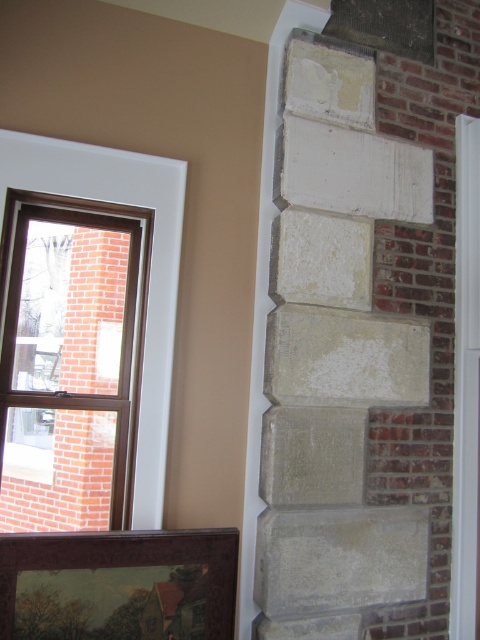
Between white stone carving at center and brown wooden picture frame at lower left, which one appears on the right side from the viewer's perspective?

Positioned to the right is white stone carving at center.

Is white stone carving at center closer to camera compared to brown wooden picture frame at lower left?

No, it is not.

Does point (292, 259) lie in front of point (176, 627)?

No.

Find the location of a particular element. This screenshot has width=480, height=640. white stone carving at center is located at coordinates (335, 355).

Can you confirm if clear glass window at upper left is wider than brown wooden picture frame at lower left?

No, clear glass window at upper left is not wider than brown wooden picture frame at lower left.

Who is taller, clear glass window at upper left or brown wooden picture frame at lower left?

clear glass window at upper left is taller.

Which is in front, point (91, 346) or point (0, 547)?

Positioned in front is point (0, 547).

At what (x,y) coordinates should I click in order to perform the action: click on clear glass window at upper left. Please return your answer as a coordinate pair (x, y). The width and height of the screenshot is (480, 640). Looking at the image, I should click on (70, 360).

Is white stone carving at center to the right of clear glass window at upper left from the viewer's perspective?

Indeed, white stone carving at center is positioned on the right side of clear glass window at upper left.

Who is more forward, [424,576] or [96,481]?

Point [96,481]

Where is `white stone carving at center`? The height and width of the screenshot is (640, 480). white stone carving at center is located at coordinates (335, 355).

Where is `white stone carving at center`? This screenshot has height=640, width=480. white stone carving at center is located at coordinates (335, 355).